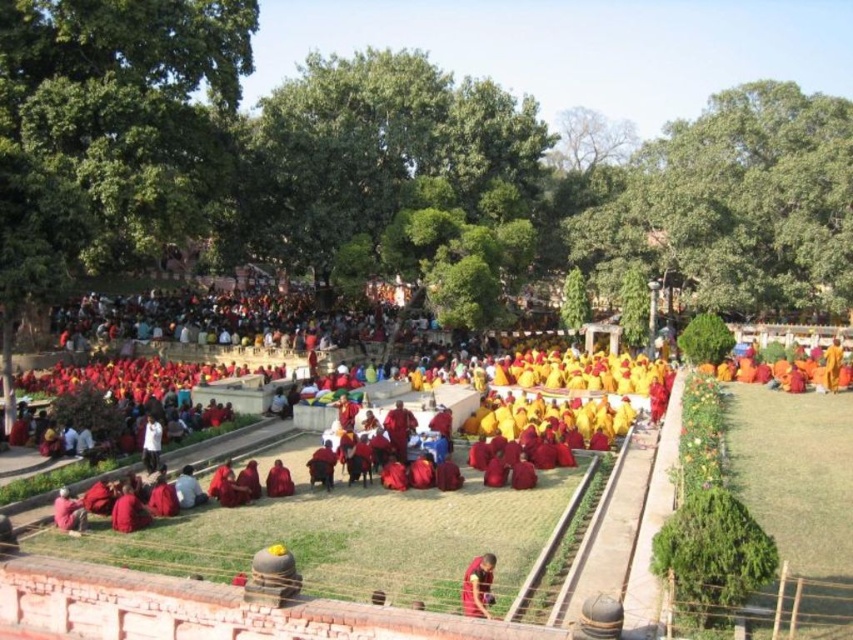
You are a photographer standing at the camera position. You want to capture a closeup shot of the red cotton robes at center. Given that your telephoto lens has a maximum effective range of 100 feet, will you be able to take the photo without moving closer?

The red cotton robes at center and camera are 122.92 feet apart, which exceeds the telephoto lens maximum effective range of 100 feet. Therefore, you cannot take the photo without moving closer.

You are standing at the edge of the gathering and want to take a photo of both the point at coordinates point (x=202, y=502) and point (x=480, y=572). Which point will appear closer to the camera in your photo?

Point (x=202, y=502) is further to the camera than point (x=480, y=572), so in the photo, point (x=480, y=572) will appear closer to the camera.